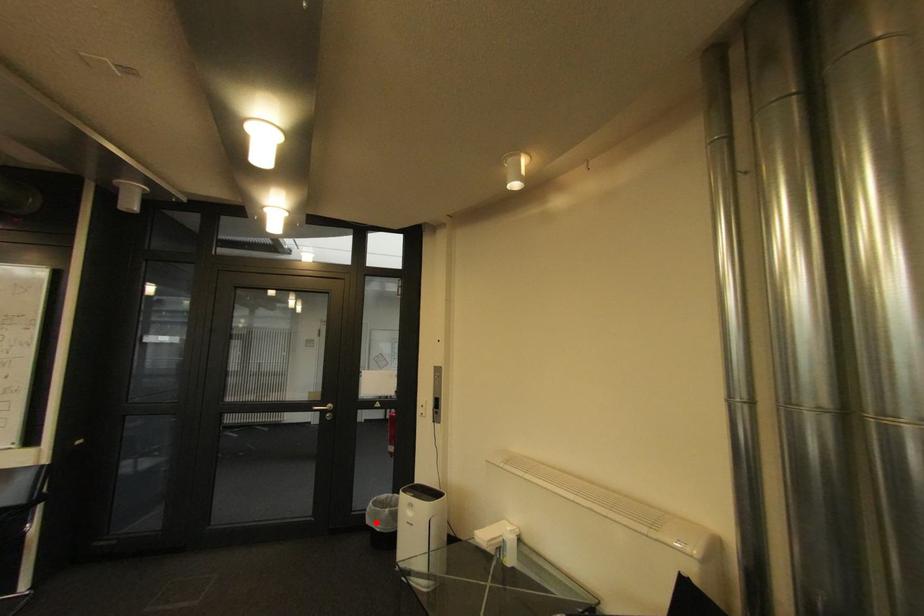
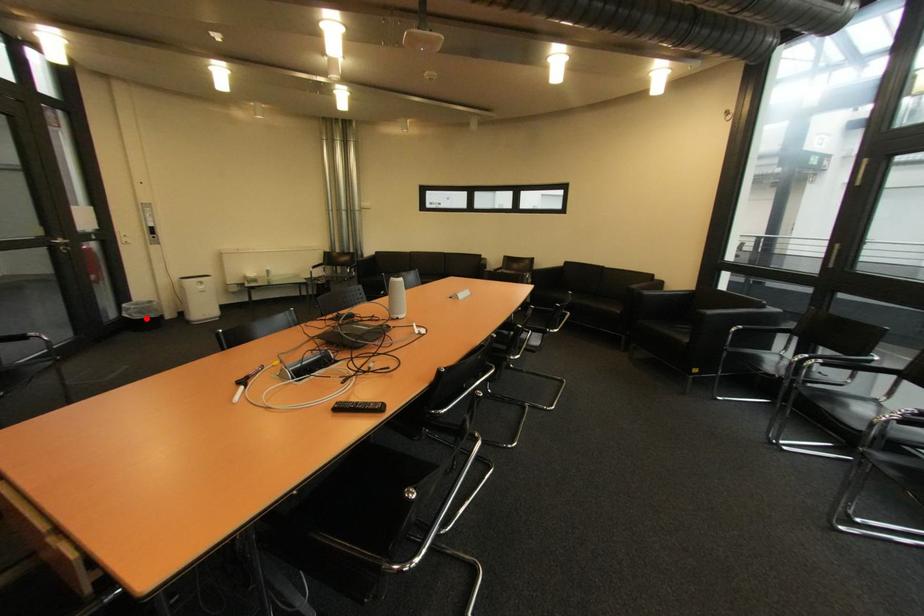
I am providing you with two images of the same scene from different viewpoints. A red point is marked on the first image and another point is marked on the second image. Is the red point in image1 aligned with the point shown in image2?

Yes